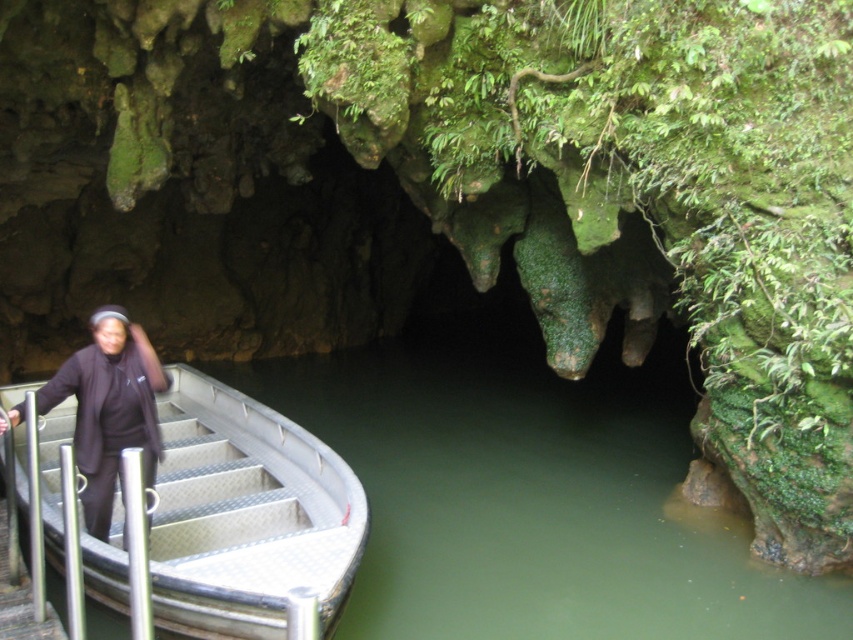
Can you confirm if silver/aluminum boat at left is smaller than black fabric headscarf at left?

Actually, silver/aluminum boat at left might be larger than black fabric headscarf at left.

Can you confirm if silver/aluminum boat at left is positioned to the right of black fabric headscarf at left?

Correct, you'll find silver/aluminum boat at left to the right of black fabric headscarf at left.

You are a GUI agent. You are given a task and a screenshot of the screen. Output one action in this format:
    pyautogui.click(x=<x>, y=<y>)
    Task: Click on the silver/aluminum boat at left
    The height and width of the screenshot is (640, 853).
    Given the screenshot: What is the action you would take?
    pyautogui.click(x=247, y=515)